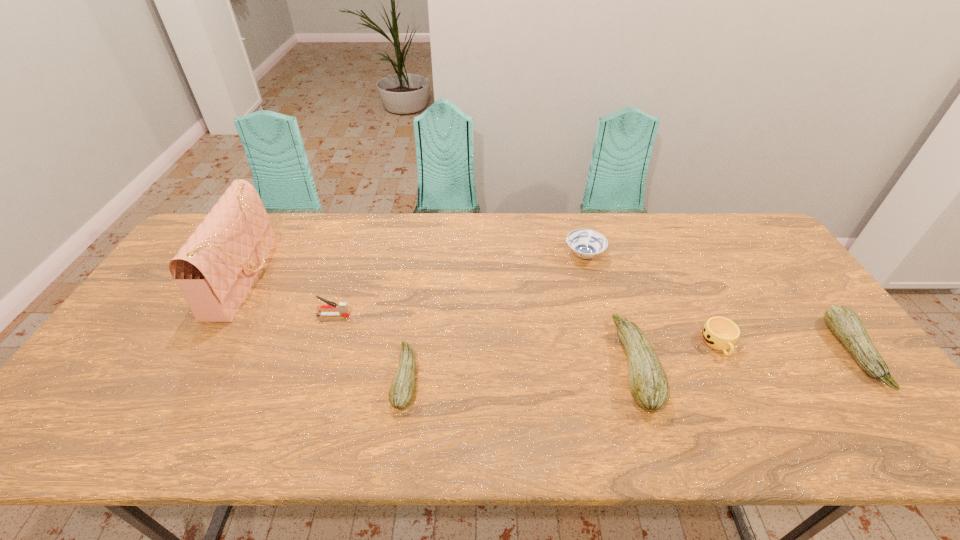
This screenshot has width=960, height=540. I want to click on free spot between the stapler and the second shortest zucchini, so click(x=593, y=334).

Where is `free space between the shortest zucchini and the stapler`? Image resolution: width=960 pixels, height=540 pixels. free space between the shortest zucchini and the stapler is located at coordinates [x=370, y=346].

You are a GUI agent. You are given a task and a screenshot of the screen. Output one action in this format:
    pyautogui.click(x=<x>, y=<y>)
    Task: Click on the unoccupied position between the soup bowl and the handbag
    This screenshot has height=540, width=960.
    Given the screenshot: What is the action you would take?
    pyautogui.click(x=416, y=266)

The image size is (960, 540). Find the location of `vacant space that's between the third object from left to right and the second zucchini from left to right`. vacant space that's between the third object from left to right and the second zucchini from left to right is located at coordinates (520, 371).

You are a GUI agent. You are given a task and a screenshot of the screen. Output one action in this format:
    pyautogui.click(x=<x>, y=<y>)
    Task: Click on the unoccupied area between the leftmost zucchini and the second object from right to left
    Image resolution: width=960 pixels, height=540 pixels.
    Given the screenshot: What is the action you would take?
    pyautogui.click(x=563, y=361)

Where is `vacant space in between the soup bowl and the second tallest zucchini`? vacant space in between the soup bowl and the second tallest zucchini is located at coordinates pos(718,303).

In order to click on free space between the soup bowl and the shortest zucchini in this screenshot , I will do `click(495, 316)`.

Find the location of `empty space between the leftmost object and the cup`. empty space between the leftmost object and the cup is located at coordinates (483, 310).

Identify the location of object that is the second closest to the leftmost object. This screenshot has width=960, height=540. (401, 392).

Locate which object ranks fourth in proximity to the second object from right to left. Please provide its 2D coordinates. Your answer should be formatted as a tuple, i.e. [(x, y)], where the tuple contains the x and y coordinates of a point satisfying the conditions above.

[(401, 392)]